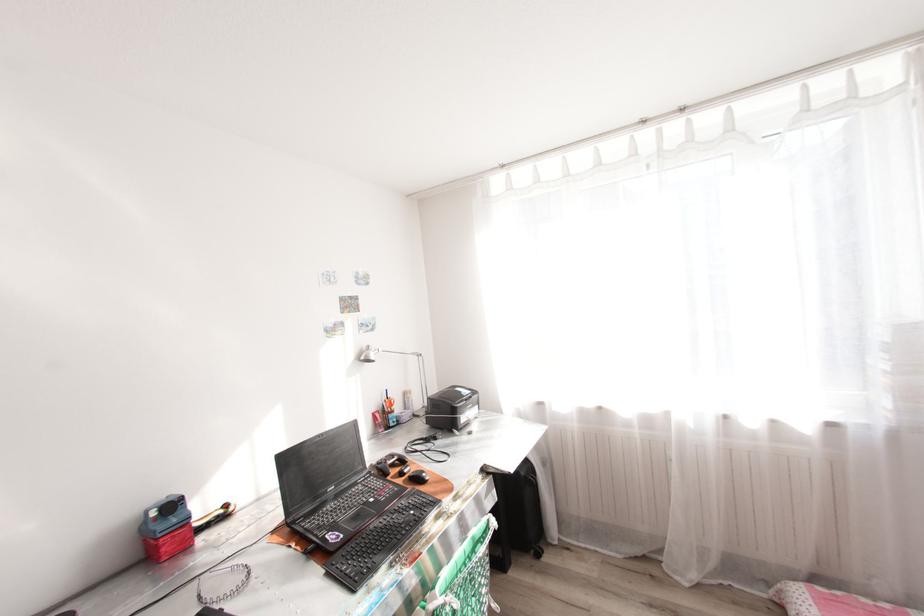
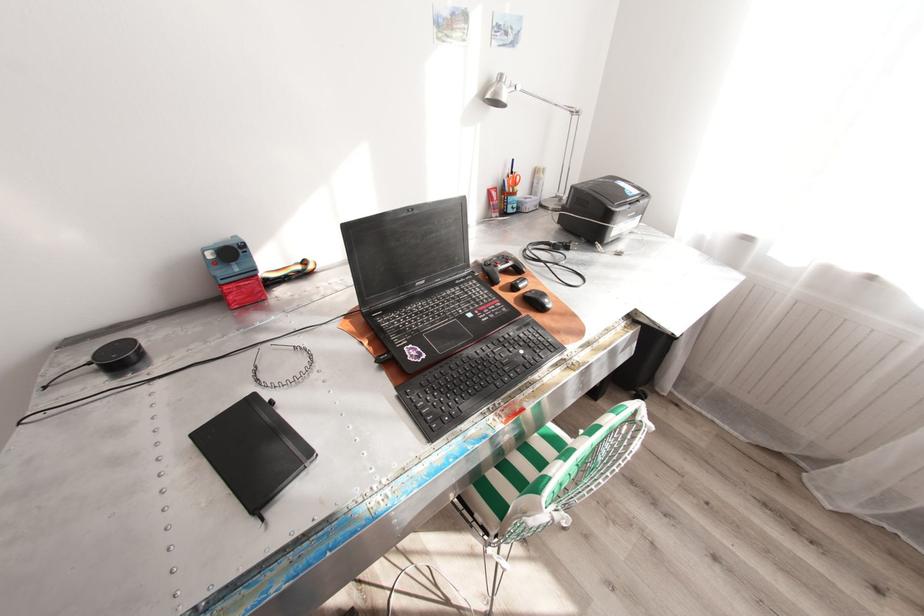
Where in the second image is the point corresponding to [157,514] from the first image?

(215, 254)